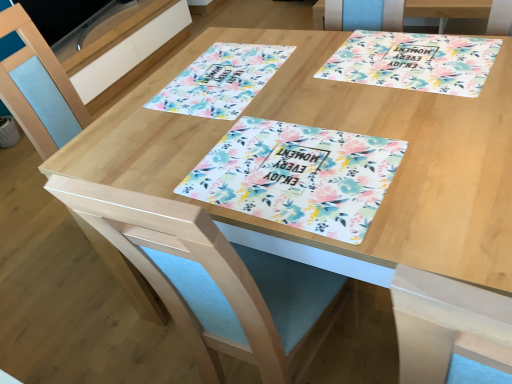
Question: From the image's perspective, is floral paper placemat at center, the 2th flyer positioned from the top, above or below white glossy drawer at upper left?

Choices:
 (A) above
 (B) below

Answer: (B)

Question: Is floral paper placemat at center, the 2th flyer positioned from the top, to the left or to the right of white glossy drawer at upper left in the image?

Choices:
 (A) left
 (B) right

Answer: (B)

Question: Estimate the real-world distances between objects in this image. Which object is closer to the white glossy drawer at upper left?

Choices:
 (A) floral paper placemat at center, which is counted as the 1th flyer, starting from the bottom
 (B) blue fabric swivel chair at center
 (C) floral paper placemat at upper right
 (D) floral paper placemat at upper center, marked as the 1th flyer in a top-to-bottom arrangement
 (E) light blue fabric chair at lower left

Answer: (E)

Question: Estimate the real-world distances between objects in this image. Which object is closer to the light blue fabric chair at lower left?

Choices:
 (A) white glossy drawer at upper left
 (B) blue fabric swivel chair at center
 (C) floral paper placemat at center, the second flyer when ordered from back to front
 (D) floral paper placemat at upper right
 (E) floral paper placemat at upper center, acting as the second flyer starting from the front

Answer: (E)